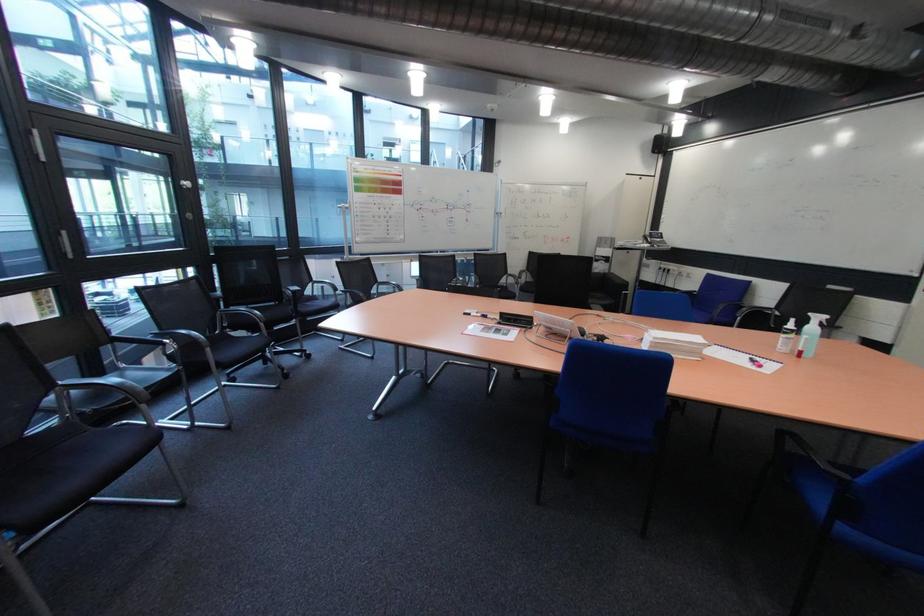
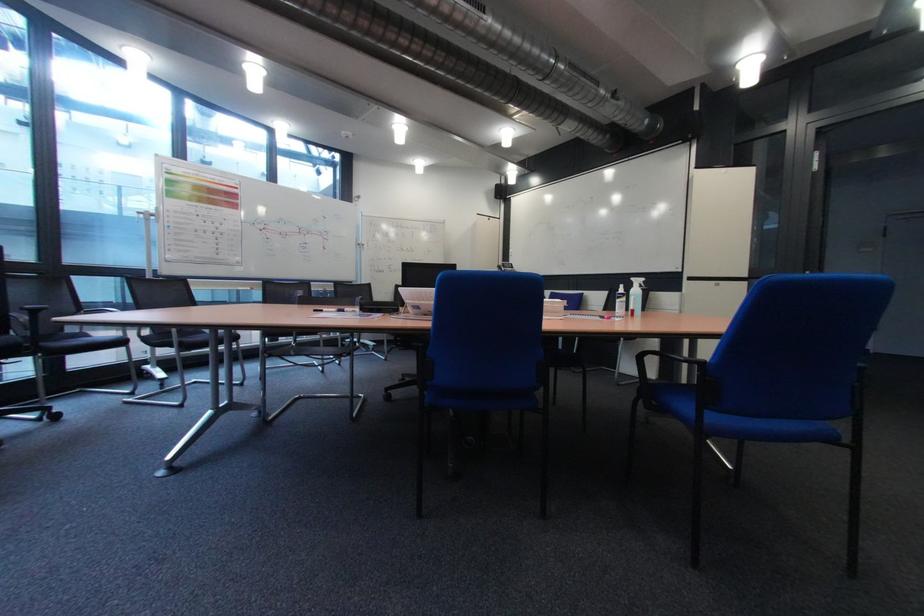
Question: In a continuous first-person perspective shot, in which direction is the camera moving?

Choices:
 (A) Left
 (B) Right
 (C) Forward
 (D) Backward

Answer: (C)